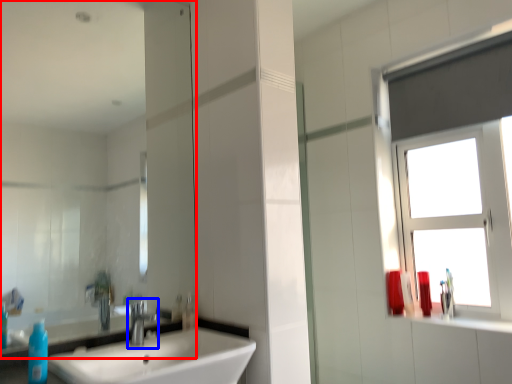
Question: Among these objects, which one is farthest to the camera, mirror (highlighted by a red box) or tap (highlighted by a blue box)?

Choices:
 (A) mirror
 (B) tap

Answer: (B)